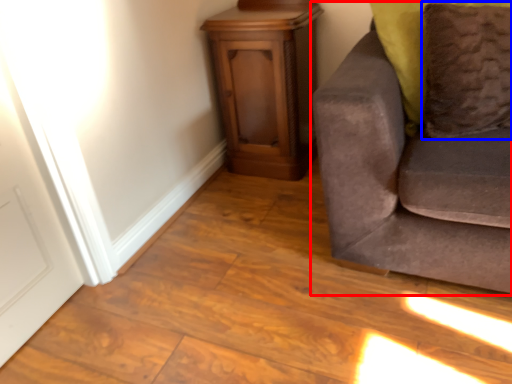
Question: Which object appears farthest to the camera in this image, studio couch (highlighted by a red box) or pillow (highlighted by a blue box)?

Choices:
 (A) studio couch
 (B) pillow

Answer: (B)